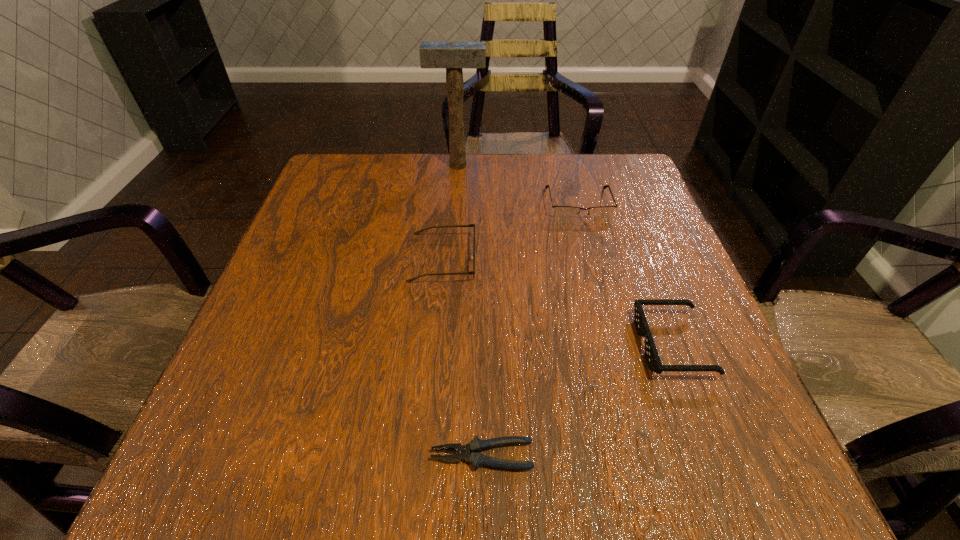
Find the location of `free space located on the front-facing side of the second farthest object`. free space located on the front-facing side of the second farthest object is located at coordinates (606, 307).

The image size is (960, 540). I want to click on vacant space located on the front-facing side of the left spectacles, so click(x=567, y=258).

Find the location of a particular element. This screenshot has height=540, width=960. vacant space situated on the front-facing side of the second nearest object is located at coordinates (474, 345).

Image resolution: width=960 pixels, height=540 pixels. In order to click on blank area located 0.200m on the front-facing side of the second nearest object in this screenshot , I will do `click(530, 345)`.

The width and height of the screenshot is (960, 540). Identify the location of vacant space located on the front-facing side of the second nearest object. (463, 345).

Where is `vacant space located at the gripping part of the shortest object`? The width and height of the screenshot is (960, 540). vacant space located at the gripping part of the shortest object is located at coordinates (201, 455).

Image resolution: width=960 pixels, height=540 pixels. What are the coordinates of `free space located 0.210m at the gripping part of the shortest object` in the screenshot? It's located at (289, 455).

Identify the location of vacant area located at the gripping part of the shortest object. The image size is (960, 540). (309, 455).

Find the location of a particular element. This screenshot has height=540, width=960. mallet that is at the far edge is located at coordinates (453, 56).

Identify the location of spectacles positioned at the far edge. This screenshot has height=540, width=960. (562, 212).